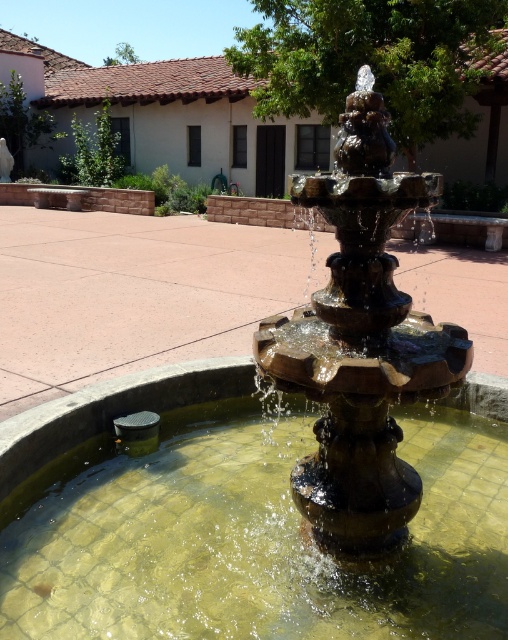
The height and width of the screenshot is (640, 508). What are the coordinates of `brown stone fountain at center` in the screenshot? It's located at (244, 524).

Does point (265, 493) come behind point (70, 220)?

No, it is not.

Image resolution: width=508 pixels, height=640 pixels. What are the coordinates of `brown stone fountain at center` in the screenshot? It's located at (244, 524).